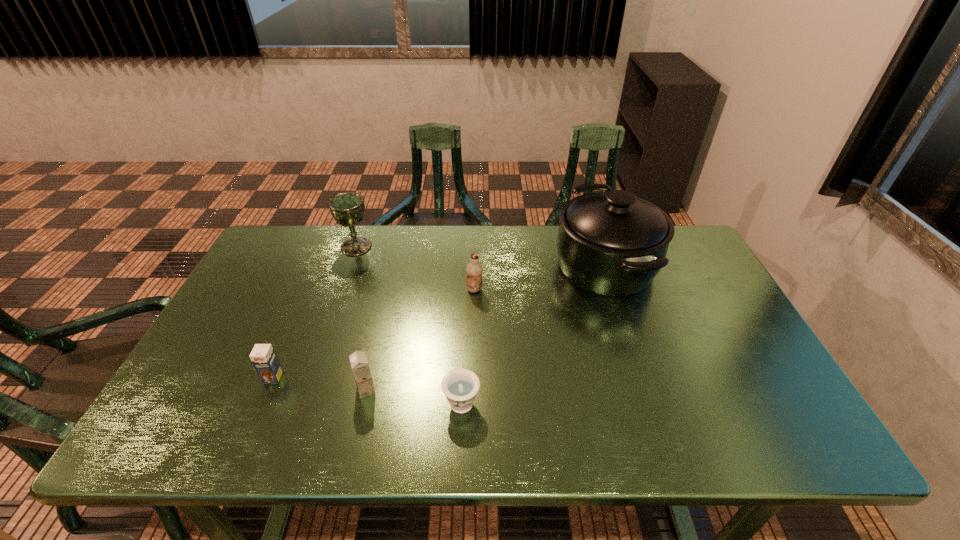
This screenshot has height=540, width=960. Find the location of `object present at the far right corner`. object present at the far right corner is located at coordinates (613, 243).

This screenshot has width=960, height=540. I want to click on free region at the far edge, so click(450, 259).

Locate an element on the screen. The image size is (960, 540). vacant region at the near edge of the desktop is located at coordinates (585, 440).

This screenshot has width=960, height=540. In order to click on free location at the left edge of the desktop in this screenshot , I will do `click(212, 358)`.

Identify the location of free space at the far left corner. (284, 248).

At what (x,y) coordinates should I click in order to perform the action: click on free space at the far right corner. Please return your answer as a coordinate pair (x, y). The width and height of the screenshot is (960, 540). Looking at the image, I should click on (681, 226).

Identify the location of empty space between the rightmost chocolate milk and the chalice. The image size is (960, 540). (416, 268).

Find the location of a particular element. The height and width of the screenshot is (540, 960). unoccupied position between the fifth shortest object and the second chocolate milk from left to right is located at coordinates (361, 318).

I want to click on empty space between the fifth object from right to left and the fourth object from right to left, so pyautogui.click(x=361, y=318).

At what (x,y) coordinates should I click in order to perform the action: click on free space between the leftmost object and the rightmost chocolate milk. Please return your answer as a coordinate pair (x, y). Looking at the image, I should click on (374, 334).